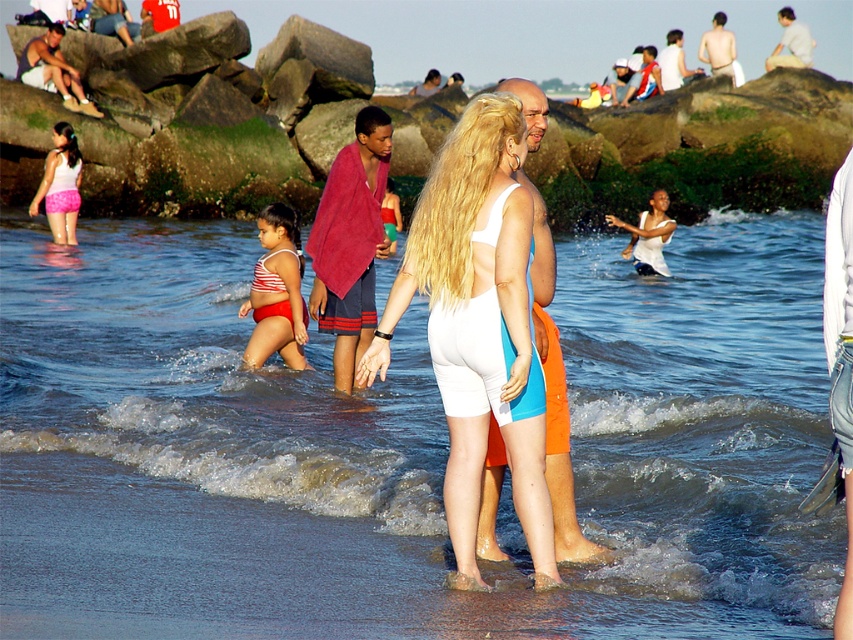
Between striped fabric swimsuit at center and pink fabric shorts at left, which one has more height?

pink fabric shorts at left is taller.

Is point (296, 332) closer to camera compared to point (74, 216)?

Yes.

The width and height of the screenshot is (853, 640). Describe the element at coordinates (276, 292) in the screenshot. I see `striped fabric swimsuit at center` at that location.

Identify the location of striped fabric swimsuit at center. (276, 292).

Is clear blue water at center to the left of pink fabric shorts at left from the viewer's perspective?

In fact, clear blue water at center is to the right of pink fabric shorts at left.

Is point (810, 385) in front of point (76, 150)?

Yes, point (810, 385) is closer to viewer.

What are the coordinates of `clear blue water at center` in the screenshot? It's located at (402, 449).

Who is shorter, clear blue water at center or white matte swimsuit at center?

white matte swimsuit at center is shorter.

Is clear blue water at center bigger than white matte swimsuit at center?

Indeed, clear blue water at center has a larger size compared to white matte swimsuit at center.

Is point (819, 264) positioned behind point (479, 435)?

Yes, point (819, 264) is behind point (479, 435).

This screenshot has width=853, height=640. In order to click on clear blue water at center in this screenshot , I will do `click(402, 449)`.